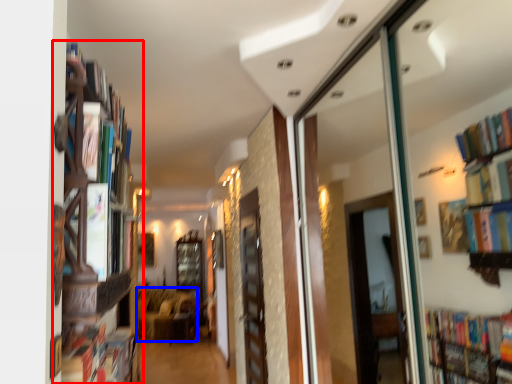
Question: Which of the following is the closest to the observer, bookcase (highlighted by a red box) or furniture (highlighted by a blue box)?

Choices:
 (A) bookcase
 (B) furniture

Answer: (A)